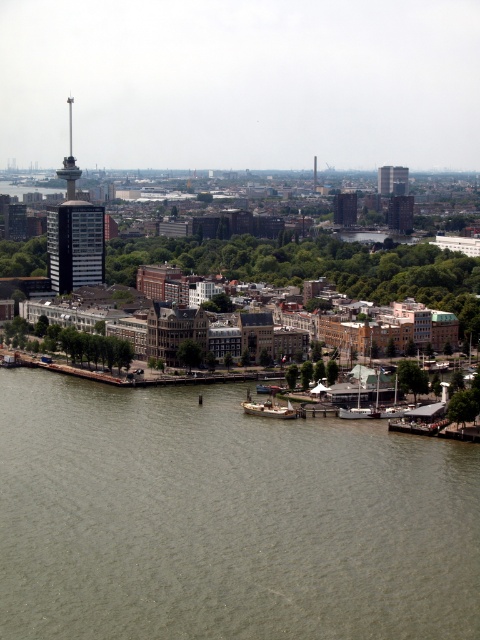
Question: Which object appears closest to the camera in this image?

Choices:
 (A) smooth glass skyscraper at upper right
 (B) wooden sailboat at lower center
 (C) greenish-gray water at lower center

Answer: (C)

Question: Can you confirm if smooth glass skyscraper at upper right is positioned above wooden sailboat at lower center?

Choices:
 (A) yes
 (B) no

Answer: (A)

Question: Is smooth glass skyscraper at upper right above wooden sailboat at lower center?

Choices:
 (A) no
 (B) yes

Answer: (B)

Question: Based on their relative distances, which object is farther from the greenish-gray water at lower center?

Choices:
 (A) wooden boat at lower right
 (B) smooth glass skyscraper at upper right
 (C) wooden sailboat at lower center

Answer: (B)

Question: Does smooth glass skyscraper at upper right appear under wooden boat at lower right?

Choices:
 (A) no
 (B) yes

Answer: (A)

Question: Which point appears closest to the camera in this image?

Choices:
 (A) (79, 278)
 (B) (274, 417)
 (C) (407, 179)

Answer: (B)